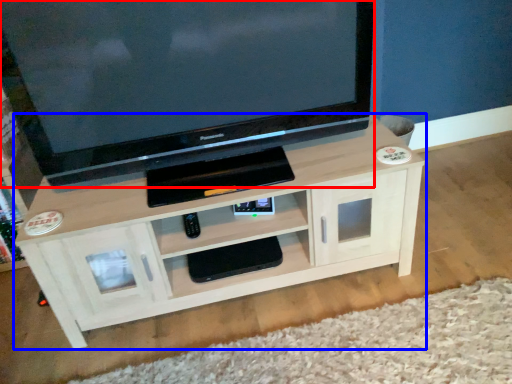
Question: Which object is closer to the camera taking this photo, television (highlighted by a red box) or shelf (highlighted by a blue box)?

Choices:
 (A) television
 (B) shelf

Answer: (A)